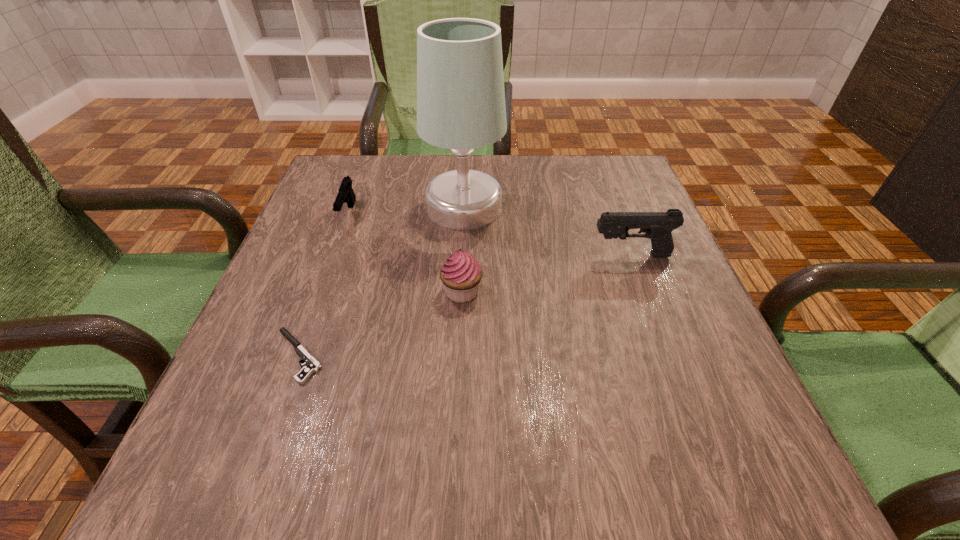
Where is `free space between the second shortest pistol and the second nearest object`? Image resolution: width=960 pixels, height=540 pixels. free space between the second shortest pistol and the second nearest object is located at coordinates (405, 253).

Find the location of `vacant area that lies between the cupcake and the third nearest object`. vacant area that lies between the cupcake and the third nearest object is located at coordinates (546, 274).

You are a GUI agent. You are given a task and a screenshot of the screen. Output one action in this format:
    pyautogui.click(x=<x>, y=<y>)
    Task: Click on the third closest object to the fourth farthest object
    
    Given the screenshot: What is the action you would take?
    pyautogui.click(x=657, y=226)

The height and width of the screenshot is (540, 960). Find the location of `object that ranks as the closest to the farthest pistol`. object that ranks as the closest to the farthest pistol is located at coordinates (461, 106).

Where is `pistol that is the closest to the nearest object`? This screenshot has height=540, width=960. pistol that is the closest to the nearest object is located at coordinates (346, 194).

Locate which pistol ranks second in proximity to the cupcake. Please provide its 2D coordinates. Your answer should be formatted as a tuple, i.e. [(x, y)], where the tuple contains the x and y coordinates of a point satisfying the conditions above.

[(657, 226)]

The width and height of the screenshot is (960, 540). I want to click on free spot that satisfies the following two spatial constraints: 1. on the base of the tallest object; 2. on the front-facing side of the second shortest pistol, so click(x=464, y=214).

Where is `vacant space that satisfies the following two spatial constraints: 1. on the base of the cupcake; 2. on the right side of the tallest object`? The image size is (960, 540). vacant space that satisfies the following two spatial constraints: 1. on the base of the cupcake; 2. on the right side of the tallest object is located at coordinates [x=461, y=292].

This screenshot has height=540, width=960. In order to click on vacant space that satisfies the following two spatial constraints: 1. on the base of the lampshade; 2. on the left side of the fourth farthest object in this screenshot , I will do `click(461, 292)`.

You are a GUI agent. You are given a task and a screenshot of the screen. Output one action in this format:
    pyautogui.click(x=<x>, y=<y>)
    Task: Click on the blank area in the image that satisfies the following two spatial constraints: 1. on the base of the tallest object; 2. on the right side of the cupcake
    This screenshot has width=960, height=540.
    Given the screenshot: What is the action you would take?
    pyautogui.click(x=461, y=292)